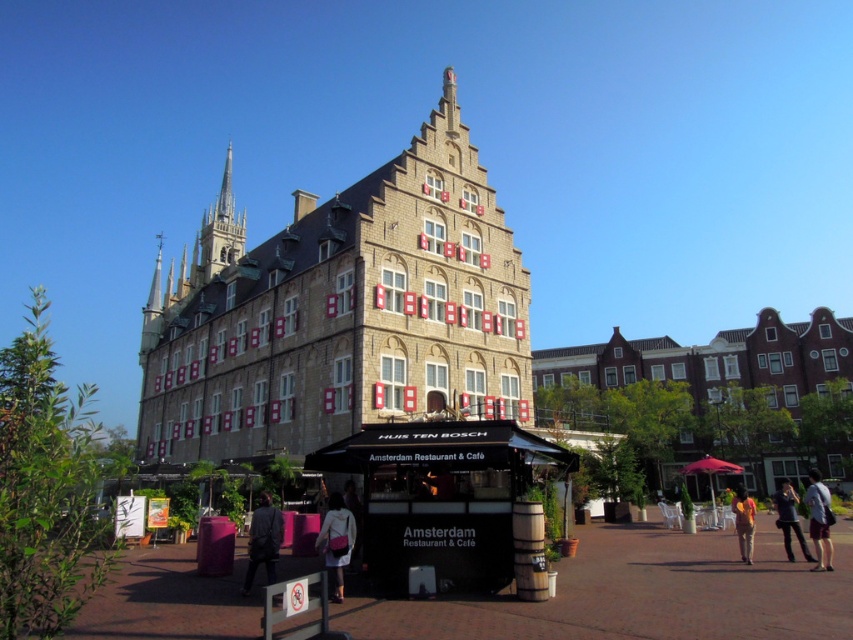
You are a tourist in the town square and want to take a photo that includes both the smooth stone spire at upper left and the yellow fabric bag at lower right. Which object should you position closer to the camera to ensure both are in focus?

To ensure both the smooth stone spire at upper left and the yellow fabric bag at lower right are in focus, position the yellow fabric bag at lower right closer to the camera since it is smaller than the smooth stone spire at upper left.

You are standing in the town square and want to take a photo of the beige stone building at center. If your camera has a maximum zoom range of 10 meters, will you need to use the zoom function to capture the entire building in the frame?

The beige stone building at center is 45.41 meters away from the camera, which exceeds the camera maximum zoom range of 10 meters. Therefore, you will need to use the zoom function to capture the entire building in the frame.